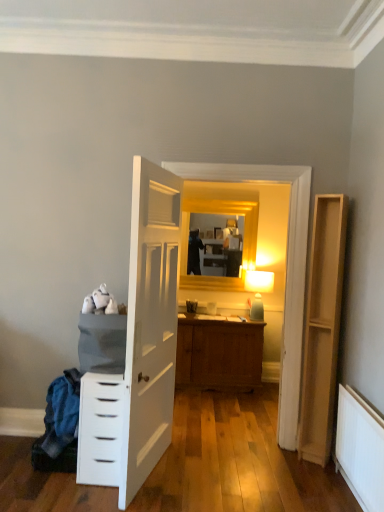
Where is `blank space above light brown wood file cabinet at right (from a real-world perspective)`? Image resolution: width=384 pixels, height=512 pixels. blank space above light brown wood file cabinet at right (from a real-world perspective) is located at coordinates (329, 195).